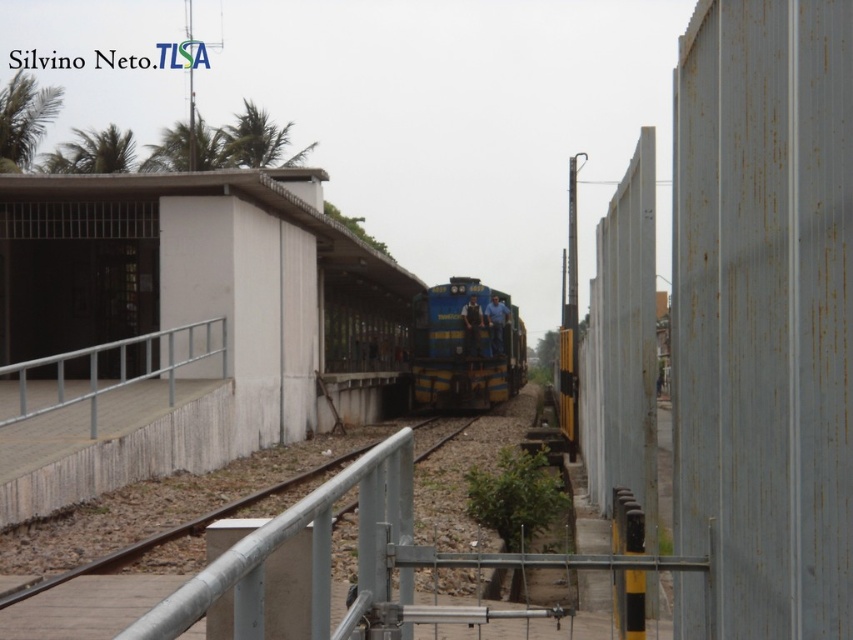
Which of these two, white concrete platform at left or silver metallic handrail at lower left, stands taller?

With more height is white concrete platform at left.

Between white concrete platform at left and silver metallic handrail at lower left, which one is positioned lower?

silver metallic handrail at lower left is lower down.

This screenshot has height=640, width=853. Describe the element at coordinates (189, 320) in the screenshot. I see `white concrete platform at left` at that location.

Locate an element on the screen. The image size is (853, 640). white concrete platform at left is located at coordinates (189, 320).

Who is lower down, blue painted metal train at center or silver metallic handrail at lower left?

blue painted metal train at center is lower down.

Based on the photo, measure the distance between blue painted metal train at center and camera.

blue painted metal train at center and camera are 40.72 meters apart from each other.

Who is more distant from viewer, (419, 353) or (22, 365)?

Point (419, 353)

This screenshot has height=640, width=853. In order to click on blue painted metal train at center in this screenshot , I will do `click(463, 348)`.

Who is higher up, white concrete platform at left or blue painted metal train at center?

white concrete platform at left is above.

Is white concrete platform at left taller than blue painted metal train at center?

Indeed, white concrete platform at left has a greater height compared to blue painted metal train at center.

Is point (204, 262) positioned after point (515, 314)?

No, (204, 262) is in front of (515, 314).

In order to click on white concrete platform at left in this screenshot , I will do `click(189, 320)`.